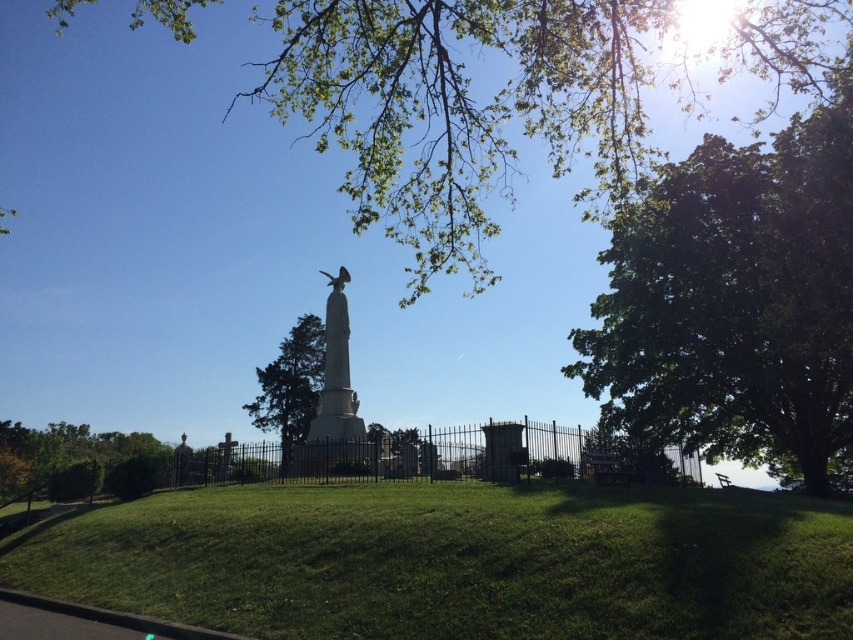
Question: Is green grassy hill at center bigger than white marble statue at center?

Choices:
 (A) no
 (B) yes

Answer: (A)

Question: Among these points, which one is farthest from the camera?

Choices:
 (A) (341, 292)
 (B) (310, 372)

Answer: (B)

Question: Is green leafy tree at upper right closer to camera compared to white marble statue at center?

Choices:
 (A) yes
 (B) no

Answer: (A)

Question: Which point is farther to the camera?

Choices:
 (A) green leafy tree at upper right
 (B) black wrought iron fence at center
 (C) green leafy tree at lower left
 (D) white marble statue at center

Answer: (D)

Question: Which is nearer to the green leafy tree at upper center?

Choices:
 (A) white marble statue at center
 (B) green leafy tree at lower left
 (C) black wrought iron fence at center

Answer: (C)

Question: Can you confirm if green leafy tree at upper right is positioned to the right of green textured tree at center?

Choices:
 (A) no
 (B) yes

Answer: (B)